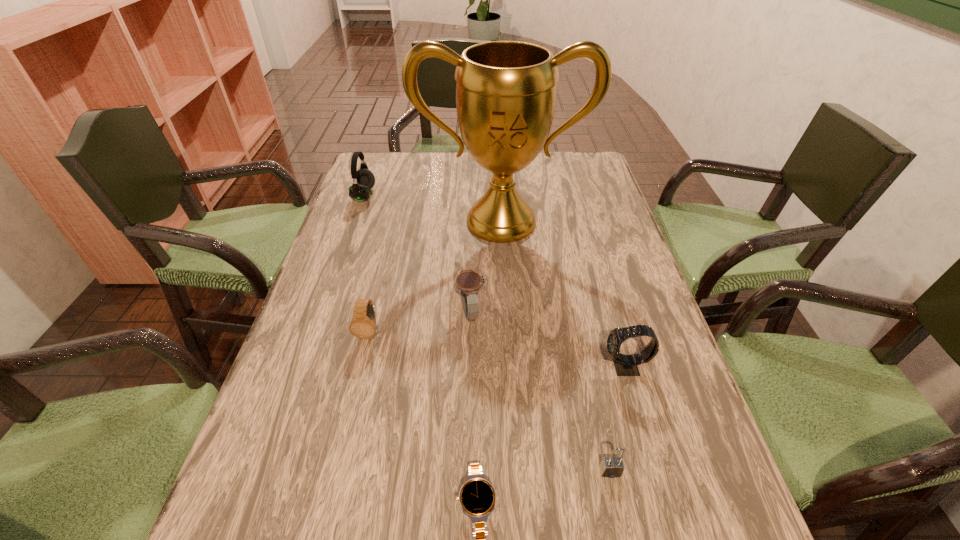
Find the location of a particular element. free space located 0.390m on the face of the third nearest object is located at coordinates (415, 367).

The height and width of the screenshot is (540, 960). I want to click on free point located on the face of the third nearest object, so click(492, 367).

This screenshot has width=960, height=540. Find the location of `blank space located on the face of the leftmost watch`. blank space located on the face of the leftmost watch is located at coordinates (348, 421).

You are a GUI agent. You are given a task and a screenshot of the screen. Output one action in this format:
    pyautogui.click(x=<x>, y=<y>)
    Task: Click on the object that is at the far edge
    This screenshot has width=960, height=540.
    Given the screenshot: What is the action you would take?
    pyautogui.click(x=363, y=180)

The width and height of the screenshot is (960, 540). Identify the location of headset positioned at the left edge. (363, 180).

I want to click on watch situated at the left edge, so click(x=363, y=324).

Locate an element on the screen. trophy cup at the right edge is located at coordinates (506, 91).

Locate an element on the screen. watch present at the right edge is located at coordinates (625, 365).

At what (x,y) coordinates should I click in order to perform the action: click on object at the far left corner. Please return your answer as a coordinate pair (x, y). The height and width of the screenshot is (540, 960). Looking at the image, I should click on (363, 180).

Find the location of a particular element. The width and height of the screenshot is (960, 540). vacant space at the far edge of the desktop is located at coordinates (461, 159).